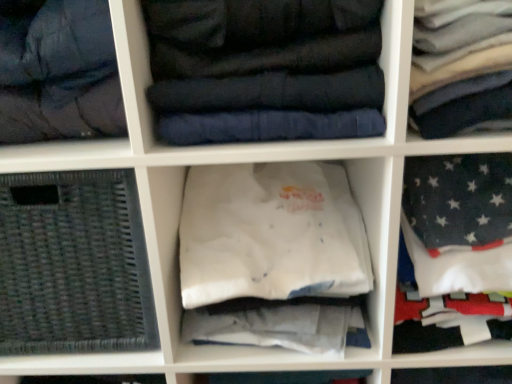
The height and width of the screenshot is (384, 512). In order to click on white cotton shirt at upper right, marked as the third clothing in a left-to-right arrangement in this screenshot , I will do `click(461, 67)`.

What do you see at coordinates (461, 67) in the screenshot?
I see `white cotton shirt at upper right, marked as the third clothing in a left-to-right arrangement` at bounding box center [461, 67].

What do you see at coordinates (265, 70) in the screenshot?
I see `dark blue quilted jacket at center, marked as the 1th clothing in a left-to-right arrangement` at bounding box center [265, 70].

You are a GUI agent. You are given a task and a screenshot of the screen. Output one action in this format:
    pyautogui.click(x=<x>, y=<y>)
    Task: Click on the white cotton shirt at upper right, the 1th clothing positioned from the right
    
    Given the screenshot: What is the action you would take?
    pyautogui.click(x=461, y=67)

Is dark blue quilted jacket at center, marked as the 1th clothing in a left-to-right arrangement, bigger than dark gray quilted jacket at upper left?

Correct, dark blue quilted jacket at center, marked as the 1th clothing in a left-to-right arrangement, is larger in size than dark gray quilted jacket at upper left.

Is dark blue quilted jacket at center, marked as the 1th clothing in a left-to-right arrangement, far away from dark gray quilted jacket at upper left?

dark blue quilted jacket at center, marked as the 1th clothing in a left-to-right arrangement, is near dark gray quilted jacket at upper left, not far away.

Considering the sizes of objects dark blue quilted jacket at center, acting as the third clothing starting from the right, and dark gray quilted jacket at upper left in the image provided, who is shorter, dark blue quilted jacket at center, acting as the third clothing starting from the right, or dark gray quilted jacket at upper left?

dark blue quilted jacket at center, acting as the third clothing starting from the right, is shorter.

Can you confirm if dark blue quilted jacket at center, acting as the third clothing starting from the right, is taller than black woven basket at lower left?

No, dark blue quilted jacket at center, acting as the third clothing starting from the right, is not taller than black woven basket at lower left.

How different are the orientations of dark blue quilted jacket at center, marked as the 1th clothing in a left-to-right arrangement, and black woven basket at lower left in degrees?

The angle between the facing direction of dark blue quilted jacket at center, marked as the 1th clothing in a left-to-right arrangement, and the facing direction of black woven basket at lower left is 6.95e-05 degrees.

Consider the image. Is dark blue quilted jacket at center, marked as the 1th clothing in a left-to-right arrangement, placed right next to black woven basket at lower left?

No, dark blue quilted jacket at center, marked as the 1th clothing in a left-to-right arrangement, is not touching black woven basket at lower left.

From a real-world perspective, is dark gray quilted jacket at upper left physically located above or below dark blue quilted jacket at center, acting as the third clothing starting from the right?

dark gray quilted jacket at upper left is above dark blue quilted jacket at center, acting as the third clothing starting from the right.

Between dark gray quilted jacket at upper left and dark blue quilted jacket at center, marked as the 1th clothing in a left-to-right arrangement, which one has less height?

dark blue quilted jacket at center, marked as the 1th clothing in a left-to-right arrangement, is shorter.

Is dark gray quilted jacket at upper left aimed at dark blue quilted jacket at center, marked as the 1th clothing in a left-to-right arrangement?

No, dark gray quilted jacket at upper left is not turned towards dark blue quilted jacket at center, marked as the 1th clothing in a left-to-right arrangement.

In the scene shown: Are dark gray quilted jacket at upper left and dark blue quilted jacket at center, acting as the third clothing starting from the right, far apart?

dark gray quilted jacket at upper left is actually quite close to dark blue quilted jacket at center, acting as the third clothing starting from the right.

Which is behind, point (78, 105) or point (44, 187)?

Positioned behind is point (44, 187).

Looking at the image, does dark gray quilted jacket at upper left seem bigger or smaller compared to black woven basket at lower left?

Considering their sizes, dark gray quilted jacket at upper left takes up less space than black woven basket at lower left.

Is dark gray quilted jacket at upper left looking in the opposite direction of black woven basket at lower left?

dark gray quilted jacket at upper left is not turned away from black woven basket at lower left.

From the image's perspective, between dark gray quilted jacket at upper left and black woven basket at lower left, who is located below?

black woven basket at lower left is shown below in the image.

From the image's perspective, which one is positioned lower, black woven basket at lower left or white cotton shirt at upper right, marked as the third clothing in a left-to-right arrangement?

black woven basket at lower left.

Choose the correct answer: Is black woven basket at lower left inside white cotton shirt at upper right, the 1th clothing positioned from the right, or outside it?

black woven basket at lower left is outside white cotton shirt at upper right, the 1th clothing positioned from the right.

I want to click on basket that is under the white cotton shirt at upper right, marked as the third clothing in a left-to-right arrangement (from a real-world perspective), so click(73, 264).

From a real-world perspective, which object rests below the other?

black woven basket at lower left, from a real-world perspective.

Choose the correct answer: Is black woven basket at lower left inside dark gray quilted jacket at upper left or outside it?

black woven basket at lower left is not inside dark gray quilted jacket at upper left, it's outside.

Is black woven basket at lower left not near dark gray quilted jacket at upper left?

black woven basket at lower left is actually quite close to dark gray quilted jacket at upper left.

Which is in front, black woven basket at lower left or dark gray quilted jacket at upper left?

dark gray quilted jacket at upper left is closer to the camera.

Considering the relative sizes of white cotton t-shirt at center, acting as the 2th clothing starting from the left, and black woven basket at lower left in the image provided, is white cotton t-shirt at center, acting as the 2th clothing starting from the left, wider than black woven basket at lower left?

Correct, the width of white cotton t-shirt at center, acting as the 2th clothing starting from the left, exceeds that of black woven basket at lower left.

In the scene shown: Is white cotton t-shirt at center, which is the second clothing in right-to-left order, positioned in front of black woven basket at lower left?

Yes, it is.

Is white cotton t-shirt at center, acting as the 2th clothing starting from the left, in contact with black woven basket at lower left?

No, white cotton t-shirt at center, acting as the 2th clothing starting from the left, is not next to black woven basket at lower left.

Is white cotton t-shirt at center, which is the second clothing in right-to-left order, aimed at black woven basket at lower left?

No, white cotton t-shirt at center, which is the second clothing in right-to-left order, is not facing towards black woven basket at lower left.

Identify the location of garment located above the dark blue quilted jacket at center, acting as the third clothing starting from the right (from a real-world perspective). The width and height of the screenshot is (512, 384). (58, 71).

Find the location of `the 2nd clothing in front of the black woven basket at lower left, counting from the anchor's position`. the 2nd clothing in front of the black woven basket at lower left, counting from the anchor's position is located at coordinates (265, 70).

Consider the image. Considering their positions, is dark blue quilted jacket at center, marked as the 1th clothing in a left-to-right arrangement, positioned closer to black woven basket at lower left than dark gray quilted jacket at upper left?

Based on the image, dark gray quilted jacket at upper left appears to be nearer to black woven basket at lower left.

Which object lies nearer to the anchor point dark blue quilted jacket at center, acting as the third clothing starting from the right, black woven basket at lower left or dark gray quilted jacket at upper left?

Among the two, dark gray quilted jacket at upper left is located nearer to dark blue quilted jacket at center, acting as the third clothing starting from the right.

Looking at the image, which one is located closer to white cotton t-shirt at center, acting as the 2th clothing starting from the left, dark gray quilted jacket at upper left or white cotton shirt at upper right, marked as the third clothing in a left-to-right arrangement?

The object closer to white cotton t-shirt at center, acting as the 2th clothing starting from the left, is dark gray quilted jacket at upper left.

Considering their positions, is black woven basket at lower left positioned further to dark gray quilted jacket at upper left than white cotton shirt at upper right, marked as the third clothing in a left-to-right arrangement?

white cotton shirt at upper right, marked as the third clothing in a left-to-right arrangement.

From the image, which object appears to be farther from dark gray quilted jacket at upper left, black woven basket at lower left or white cotton t-shirt at center, which is the second clothing in right-to-left order?

The object further to dark gray quilted jacket at upper left is white cotton t-shirt at center, which is the second clothing in right-to-left order.

Which object lies nearer to the anchor point black woven basket at lower left, white cotton shirt at upper right, the 1th clothing positioned from the right, or dark gray quilted jacket at upper left?

The object closer to black woven basket at lower left is dark gray quilted jacket at upper left.

From the image, which object appears to be farther from dark blue quilted jacket at center, marked as the 1th clothing in a left-to-right arrangement, dark gray quilted jacket at upper left or white cotton t-shirt at center, which is the second clothing in right-to-left order?

white cotton t-shirt at center, which is the second clothing in right-to-left order.

From the image, which object appears to be farther from white cotton t-shirt at center, which is the second clothing in right-to-left order, white cotton shirt at upper right, marked as the third clothing in a left-to-right arrangement, or dark blue quilted jacket at center, acting as the third clothing starting from the right?

white cotton shirt at upper right, marked as the third clothing in a left-to-right arrangement, lies further to white cotton t-shirt at center, which is the second clothing in right-to-left order, than the other object.

Find the location of a particular element. This screenshot has width=512, height=384. clothing between black woven basket at lower left and white cotton t-shirt at center, acting as the 2th clothing starting from the left is located at coordinates (265, 70).

Find the location of a particular element. This screenshot has height=384, width=512. basket between dark gray quilted jacket at upper left and white cotton shirt at upper right, marked as the third clothing in a left-to-right arrangement, from left to right is located at coordinates (73, 264).

Where is `clothing between dark blue quilted jacket at center, marked as the 1th clothing in a left-to-right arrangement, and white cotton shirt at upper right, marked as the third clothing in a left-to-right arrangement`? This screenshot has width=512, height=384. clothing between dark blue quilted jacket at center, marked as the 1th clothing in a left-to-right arrangement, and white cotton shirt at upper right, marked as the third clothing in a left-to-right arrangement is located at coordinates (270, 233).

Identify the location of clothing located between dark gray quilted jacket at upper left and white cotton t-shirt at center, which is the second clothing in right-to-left order, in the left-right direction. (265, 70).